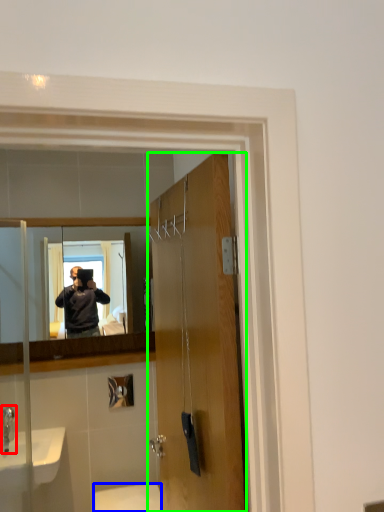
Question: Which is nearer to the faucet (highlighted by a red box)? toilet (highlighted by a blue box) or door (highlighted by a green box).

Choices:
 (A) toilet
 (B) door

Answer: (A)